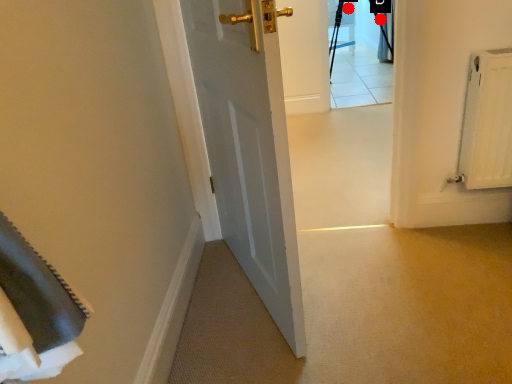
Question: Two points are circled on the image, labeled by A and B beside each circle. Among these points, which one is farthest from the camera?

Choices:
 (A) A is further
 (B) B is further

Answer: (A)